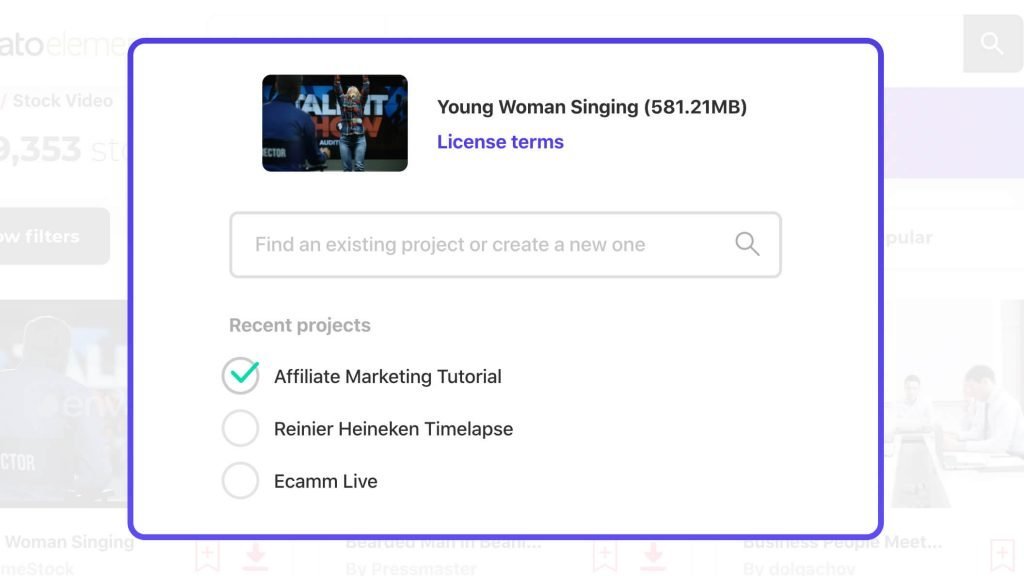
I want to click on dark wall, so click(x=400, y=135).